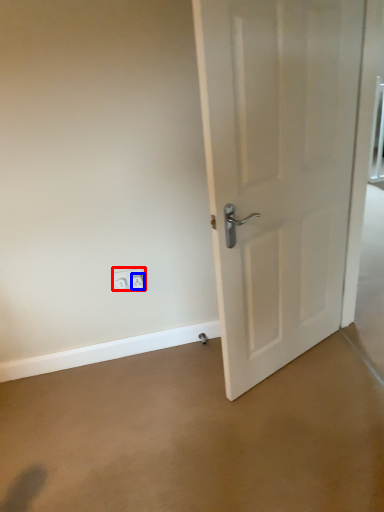
Question: Which point is further to the camera, electric outlet (highlighted by a red box) or electric outlet (highlighted by a blue box)?

Choices:
 (A) electric outlet
 (B) electric outlet

Answer: (A)